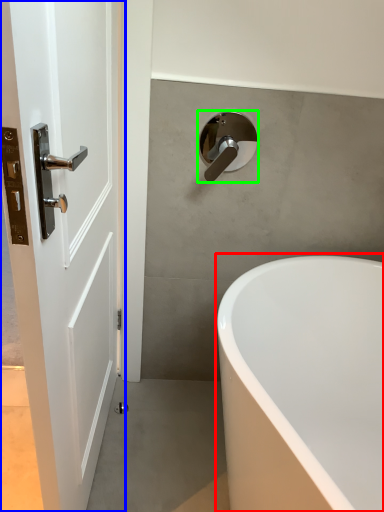
Question: Which object is positioned farthest from bathtub (highlighted by a red box)? Select from door (highlighted by a blue box) and tap (highlighted by a green box).

Choices:
 (A) door
 (B) tap

Answer: (B)